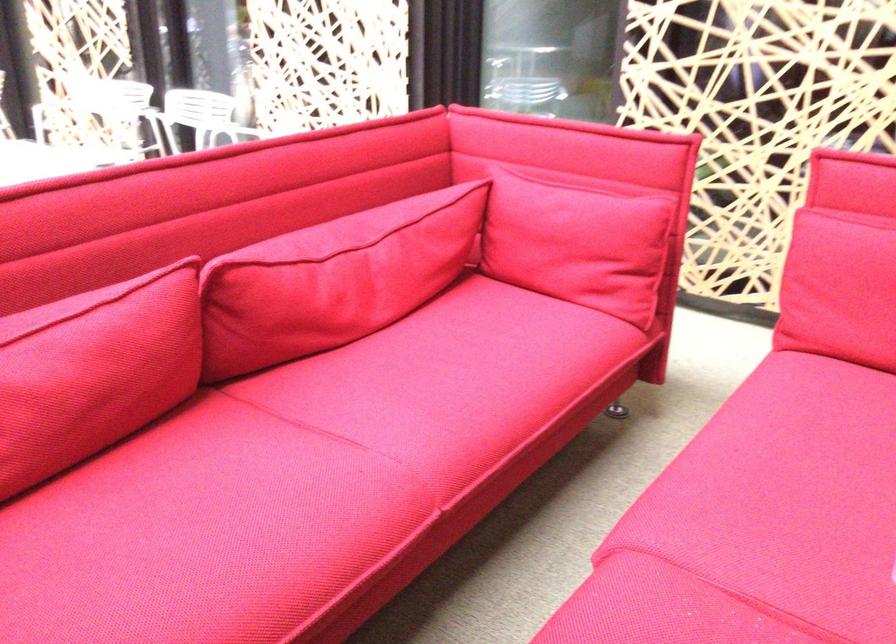
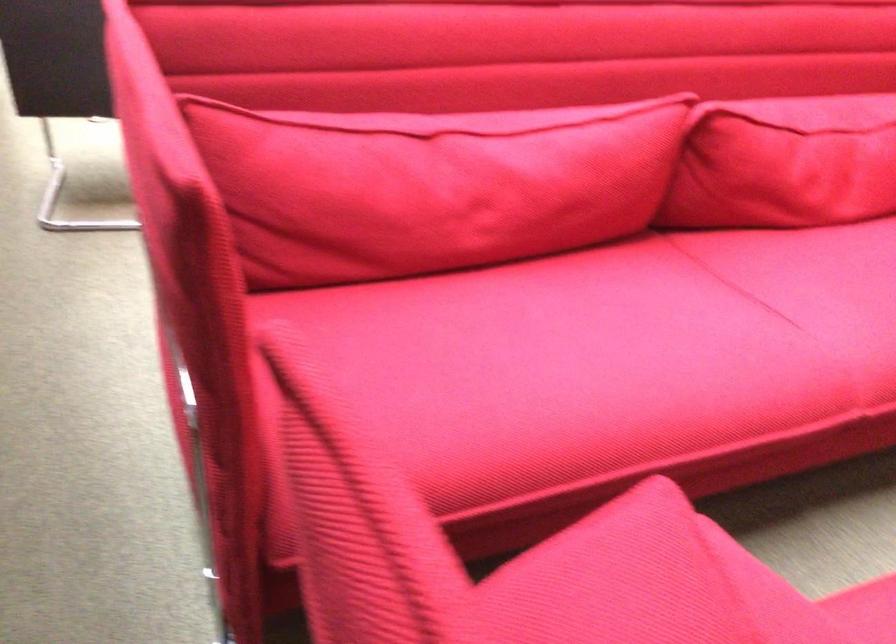
Question: The camera is either moving clockwise (left) or counter-clockwise (right) around the object. The first image is from the beginning of the video and the second image is from the end. Is the camera moving left or right when shooting the video?

Choices:
 (A) Left
 (B) Right

Answer: (B)